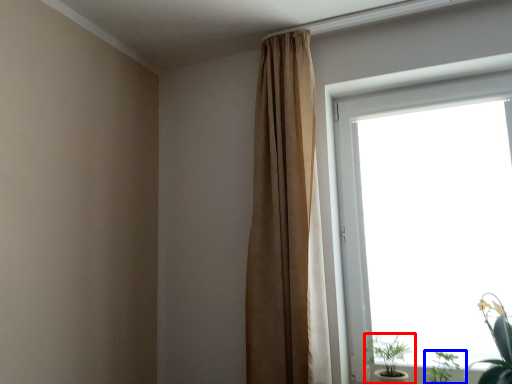
Question: Which of the following is the closest to the observer, houseplant (highlighted by a red box) or houseplant (highlighted by a blue box)?

Choices:
 (A) houseplant
 (B) houseplant

Answer: (B)